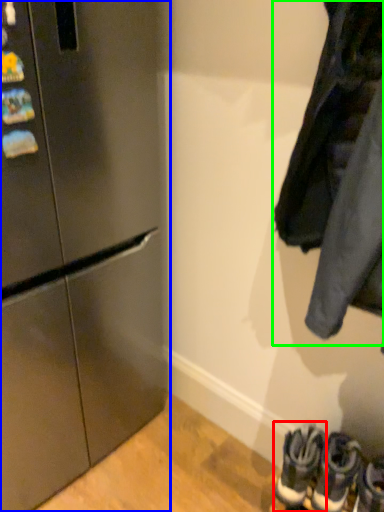
Question: Which is farther away from footwear (highlighted by a red box)? refrigerator (highlighted by a blue box) or jacket (highlighted by a green box)?

Choices:
 (A) refrigerator
 (B) jacket

Answer: (A)